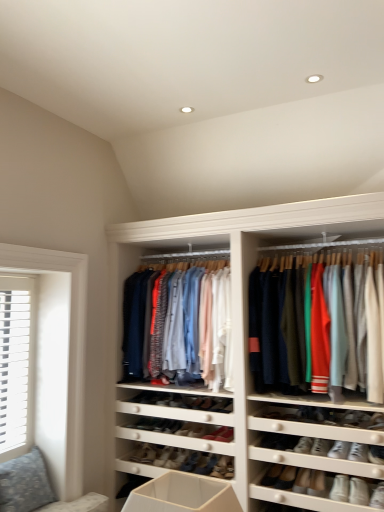
Question: Can we say matte cotton shirts at center, marked as the 2th clothing in a right-to-left arrangement, lies outside matte cotton shirts at center, acting as the 1th clothing starting from the right?

Choices:
 (A) yes
 (B) no

Answer: (A)

Question: Is matte cotton shirts at center, marked as the 2th clothing in a right-to-left arrangement, smaller than matte cotton shirts at center, acting as the 1th clothing starting from the right?

Choices:
 (A) yes
 (B) no

Answer: (A)

Question: Does matte cotton shirts at center, marked as the 2th clothing in a right-to-left arrangement, come in front of matte cotton shirts at center, acting as the 1th clothing starting from the right?

Choices:
 (A) yes
 (B) no

Answer: (B)

Question: Is matte cotton shirts at center, marked as the 2th clothing in a right-to-left arrangement, not near matte cotton shirts at center, acting as the 1th clothing starting from the right?

Choices:
 (A) yes
 (B) no

Answer: (B)

Question: Can you confirm if matte cotton shirts at center, which ranks as the 1th clothing in left-to-right order, is positioned to the left of matte cotton shirts at center, acting as the 1th clothing starting from the right?

Choices:
 (A) no
 (B) yes

Answer: (B)

Question: Do you think patterned fabric couch at lower left is within matte cotton shirts at center, arranged as the 2th clothing when viewed from the left, or outside of it?

Choices:
 (A) outside
 (B) inside

Answer: (A)

Question: In terms of size, does patterned fabric couch at lower left appear bigger or smaller than matte cotton shirts at center, acting as the 1th clothing starting from the right?

Choices:
 (A) big
 (B) small

Answer: (B)

Question: From the image's perspective, is patterned fabric couch at lower left positioned above or below matte cotton shirts at center, acting as the 1th clothing starting from the right?

Choices:
 (A) above
 (B) below

Answer: (B)

Question: Relative to matte cotton shirts at center, acting as the 1th clothing starting from the right, is patterned fabric couch at lower left in front or behind?

Choices:
 (A) front
 (B) behind

Answer: (B)

Question: Is leather sneaker at center, the 2th shoe when ordered from left to right, wider or thinner than matte cotton shirts at center, which ranks as the 1th clothing in left-to-right order?

Choices:
 (A) thin
 (B) wide

Answer: (A)

Question: Choose the correct answer: Is leather sneaker at center, the 1th shoe when ordered from bottom to top, inside matte cotton shirts at center, marked as the 2th clothing in a right-to-left arrangement, or outside it?

Choices:
 (A) outside
 (B) inside

Answer: (A)

Question: Is leather sneaker at center, the 1th shoe when ordered from bottom to top, bigger or smaller than matte cotton shirts at center, which ranks as the 1th clothing in left-to-right order?

Choices:
 (A) big
 (B) small

Answer: (B)

Question: Considering their positions, is leather sneaker at center, the 2th shoe when ordered from left to right, located in front of or behind matte cotton shirts at center, which ranks as the 1th clothing in left-to-right order?

Choices:
 (A) front
 (B) behind

Answer: (B)

Question: Looking at the image, does white slatted wood at left seem bigger or smaller compared to matte cotton shirts at center, which ranks as the 1th clothing in left-to-right order?

Choices:
 (A) big
 (B) small

Answer: (B)

Question: Is white slatted wood at left taller or shorter than matte cotton shirts at center, marked as the 2th clothing in a right-to-left arrangement?

Choices:
 (A) short
 (B) tall

Answer: (B)